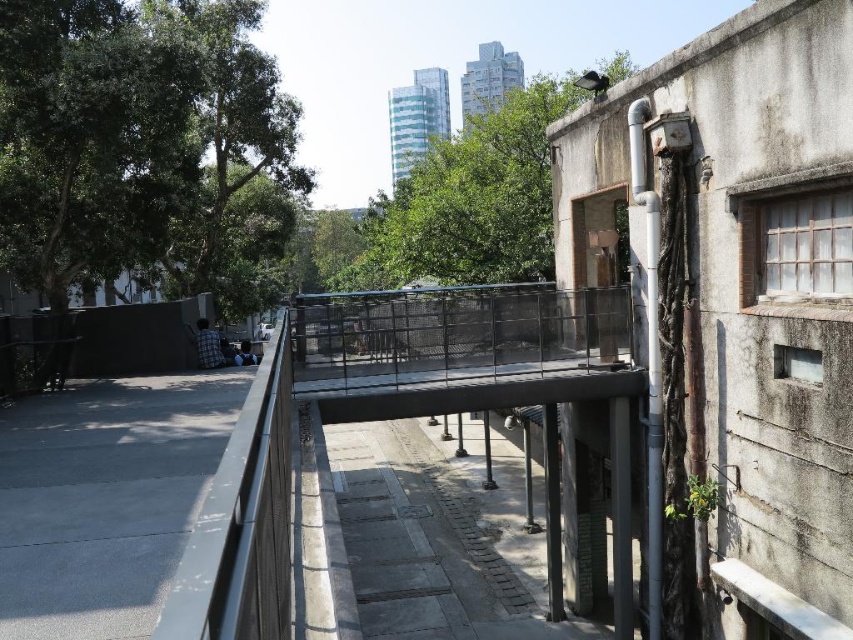
Question: Can you confirm if green leafy tree at left is smaller than green leafy tree at center?

Choices:
 (A) no
 (B) yes

Answer: (B)

Question: Is green leafy tree at left to the right of green leafy tree at center from the viewer's perspective?

Choices:
 (A) yes
 (B) no

Answer: (B)

Question: Does green leafy tree at left have a greater width compared to green leafy tree at center?

Choices:
 (A) yes
 (B) no

Answer: (B)